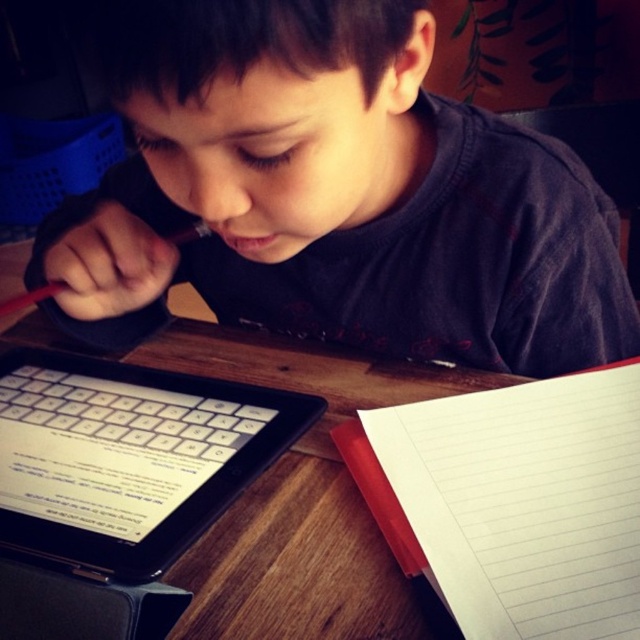
Question: Is black plastic tablet at lower left behind red matte notepad at lower right?

Choices:
 (A) no
 (B) yes

Answer: (A)

Question: Which point appears farthest from the camera in this image?

Choices:
 (A) (304, 561)
 (B) (488, 257)
 (C) (77, 477)
 (D) (426, 531)

Answer: (B)

Question: Which of the following is the closest to the observer?

Choices:
 (A) white lined paper at lower right
 (B) matte black shirt at upper center

Answer: (B)

Question: Is white lined paper at lower right wider than black plastic tablet at lower left?

Choices:
 (A) yes
 (B) no

Answer: (B)

Question: Which point appears closest to the camera in this image?

Choices:
 (A) (88, 525)
 (B) (196, 308)

Answer: (A)

Question: Can you confirm if white lined paper at lower right is positioned below wooden table at center?

Choices:
 (A) yes
 (B) no

Answer: (A)